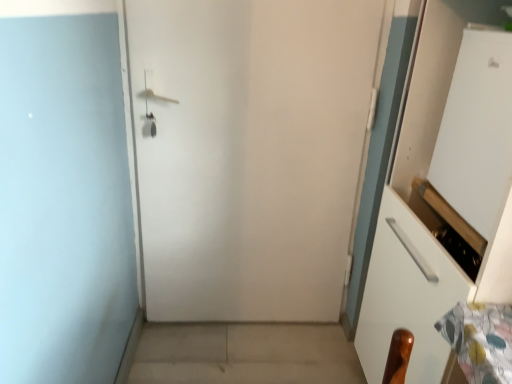
This screenshot has width=512, height=384. What do you see at coordinates (477, 131) in the screenshot?
I see `white glossy screen door at upper right` at bounding box center [477, 131].

The width and height of the screenshot is (512, 384). I want to click on beige concrete at lower center, so click(245, 354).

The width and height of the screenshot is (512, 384). I want to click on white glossy screen door at upper right, so click(477, 131).

Could you tell me if white matte door at center is facing white glossy screen door at upper right?

No.

In terms of height, does white matte door at center look taller or shorter compared to white glossy screen door at upper right?

Clearly, white matte door at center is taller compared to white glossy screen door at upper right.

Which point is more distant from viewer, (x=173, y=73) or (x=498, y=123)?

The point (x=173, y=73) is farther from the camera.

How much distance is there between white matte door at center and white glossy screen door at upper right?

25.20 inches.

From the image's perspective, which object appears higher, white glossy screen door at upper right or beige concrete at lower center?

white glossy screen door at upper right, from the image's perspective.

How many degrees apart are the facing directions of white glossy screen door at upper right and beige concrete at lower center?

They differ by 3.68 degrees in their facing directions.

Does white glossy screen door at upper right have a greater height compared to beige concrete at lower center?

Correct, white glossy screen door at upper right is much taller as beige concrete at lower center.

Which of these two, white glossy screen door at upper right or beige concrete at lower center, is wider?

With larger width is beige concrete at lower center.

Based on the photo, can you confirm if beige concrete at lower center is positioned to the right of white glossy screen door at upper right?

In fact, beige concrete at lower center is to the left of white glossy screen door at upper right.

How different are the orientations of beige concrete at lower center and white glossy screen door at upper right in degrees?

There is a 3.68-degree angle between the facing directions of beige concrete at lower center and white glossy screen door at upper right.

Who is taller, beige concrete at lower center or white glossy screen door at upper right?

white glossy screen door at upper right is taller.

How many degrees apart are the facing directions of beige concrete at lower center and white matte door at center?

The angular difference between beige concrete at lower center and white matte door at center is 89.7 degrees.

From the image's perspective, does beige concrete at lower center appear lower than white matte door at center?

Indeed, from the image's perspective, beige concrete at lower center is shown beneath white matte door at center.

Does beige concrete at lower center have a greater width compared to white matte door at center?

Correct, the width of beige concrete at lower center exceeds that of white matte door at center.

Is beige concrete at lower center far away from white matte door at center?

No.

Which is behind, white glossy screen door at upper right or white matte door at center?

white matte door at center is behind.

From a real-world perspective, is white glossy screen door at upper right on top of white matte door at center?

Yes, from a real-world perspective, white glossy screen door at upper right is on top of white matte door at center.

From the image's perspective, is white glossy screen door at upper right above or below white matte door at center?

Based on their image positions, white glossy screen door at upper right is located above white matte door at center.

Which is closer to the camera, [279,106] or [278,325]?

The point [279,106] is in front.

In terms of width, does white matte door at center look wider or thinner when compared to beige concrete at lower center?

white matte door at center is thinner than beige concrete at lower center.

Image resolution: width=512 pixels, height=384 pixels. What are the coordinates of `door beneath the white glossy screen door at upper right (from a real-world perspective)` in the screenshot? It's located at (250, 152).

The image size is (512, 384). Identify the location of screen door above the beige concrete at lower center (from a real-world perspective). (477, 131).

Estimate the real-world distances between objects in this image. Which object is closer to white glossy screen door at upper right, white matte door at center or beige concrete at lower center?

The object closer to white glossy screen door at upper right is white matte door at center.

Looking at the image, which one is located closer to white glossy screen door at upper right, beige concrete at lower center or white matte door at center?

white matte door at center is positioned closer to the anchor white glossy screen door at upper right.

When comparing their distances from beige concrete at lower center, does white glossy screen door at upper right or white matte door at center seem closer?

white matte door at center.

Which object lies nearer to the anchor point beige concrete at lower center, white matte door at center or white glossy screen door at upper right?

The object closer to beige concrete at lower center is white matte door at center.

When comparing their distances from white matte door at center, does beige concrete at lower center or white glossy screen door at upper right seem further?

white glossy screen door at upper right is further to white matte door at center.

From the image, which object appears to be nearer to white matte door at center, white glossy screen door at upper right or beige concrete at lower center?

Result: beige concrete at lower center lies closer to white matte door at center than the other object.

Identify the location of door between white glossy screen door at upper right and beige concrete at lower center in the vertical direction. (250, 152).